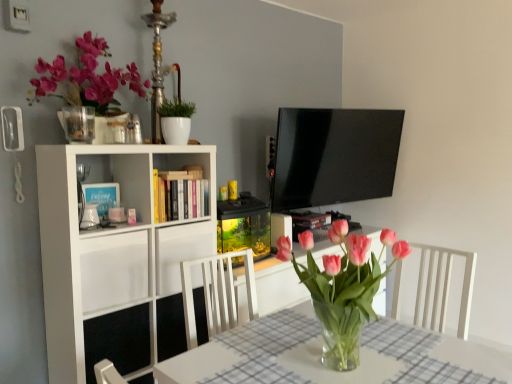
Question: Is pink glass vase at center at the back of white glossy pot at upper center?

Choices:
 (A) yes
 (B) no

Answer: (B)

Question: From the image's perspective, does white glossy pot at upper center appear higher than pink glass vase at center?

Choices:
 (A) yes
 (B) no

Answer: (A)

Question: Are white glossy pot at upper center and pink glass vase at center located far from each other?

Choices:
 (A) no
 (B) yes

Answer: (B)

Question: Considering the relative sizes of white glossy pot at upper center and pink glass vase at center in the image provided, is white glossy pot at upper center shorter than pink glass vase at center?

Choices:
 (A) no
 (B) yes

Answer: (B)

Question: Can you confirm if white glossy pot at upper center is taller than pink glass vase at center?

Choices:
 (A) no
 (B) yes

Answer: (A)

Question: Is pink glass vase at center surrounded by white glossy pot at upper center?

Choices:
 (A) no
 (B) yes

Answer: (A)

Question: Could you tell me if clear glass vase at upper left is facing matte pink flowers at upper left?

Choices:
 (A) yes
 (B) no

Answer: (B)

Question: Can you confirm if clear glass vase at upper left is taller than matte pink flowers at upper left?

Choices:
 (A) no
 (B) yes

Answer: (A)

Question: Would you say clear glass vase at upper left is outside matte pink flowers at upper left?

Choices:
 (A) yes
 (B) no

Answer: (A)

Question: From the image's perspective, does clear glass vase at upper left appear higher than matte pink flowers at upper left?

Choices:
 (A) no
 (B) yes

Answer: (A)

Question: From a real-world perspective, is clear glass vase at upper left on matte pink flowers at upper left?

Choices:
 (A) yes
 (B) no

Answer: (B)

Question: Is clear glass vase at upper left in front of matte pink flowers at upper left?

Choices:
 (A) no
 (B) yes

Answer: (A)

Question: Is white matte cabinet at left, the first cabinet in the left-to-right sequence, shorter than white matte cabinet at center, which is the first cabinet from right to left?

Choices:
 (A) yes
 (B) no

Answer: (A)